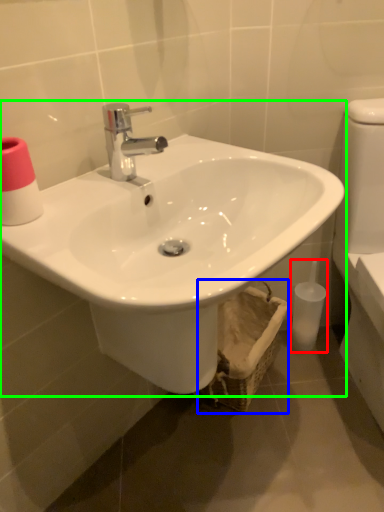
Question: Which object is the farthest from toiletry (highlighted by a red box)? Choose among these: basket (highlighted by a blue box) or sink (highlighted by a green box).

Choices:
 (A) basket
 (B) sink

Answer: (B)